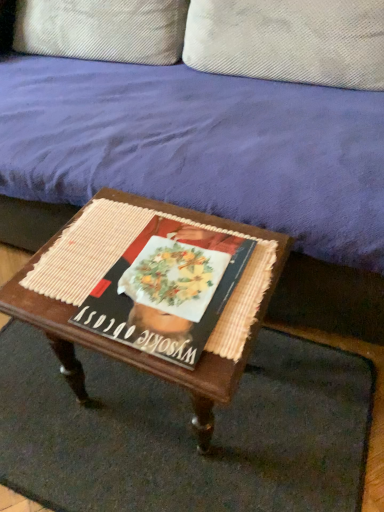
Measure the distance between velvet purple couch at upper center and camera.

The distance of velvet purple couch at upper center from camera is 83.79 centimeters.

Describe the element at coordinates (184, 433) in the screenshot. This screenshot has width=384, height=512. I see `woven mat at center` at that location.

Where is `woven mat at center`? Image resolution: width=384 pixels, height=512 pixels. woven mat at center is located at coordinates (184, 433).

I want to click on textured beige pillow at upper center, which appears as the first pillow when viewed from the left, so click(102, 29).

You are a GUI agent. You are given a task and a screenshot of the screen. Output one action in this format:
    pyautogui.click(x=<x>, y=<y>)
    Task: Click on the velvet purple couch at upper center
    The height and width of the screenshot is (512, 384).
    Given the screenshot: What is the action you would take?
    (201, 147)

Is velvet purple couch at upper center positioned before textured beige pillow at upper center, which appears as the first pillow when viewed from the left?

Yes, velvet purple couch at upper center is closer to the viewer.

I want to click on the 1st pillow directly above the velvet purple couch at upper center (from a real-world perspective), so click(102, 29).

Considering the points (49, 80) and (63, 31), which point is in front, point (49, 80) or point (63, 31)?

The point (49, 80) is in front.

Is velvet purple couch at upper center bigger than textured beige pillow at upper center, acting as the second pillow starting from the right?

Yes, velvet purple couch at upper center is bigger than textured beige pillow at upper center, acting as the second pillow starting from the right.

Which object is positioned more to the right, velvet purple couch at upper center or textured beige pillow at upper center, which ranks as the first pillow in right-to-left order?

textured beige pillow at upper center, which ranks as the first pillow in right-to-left order, is more to the right.

Is velvet purple couch at upper center facing towards textured beige pillow at upper center, the 2th pillow positioned from the left?

Yes.

Does point (182, 188) come closer to viewer compared to point (287, 26)?

Yes, it is.

Looking at this image, is textured beige pillow at upper center, acting as the second pillow starting from the right, facing away from velvet purple couch at upper center?

Yes.

Considering the positions of objects textured beige pillow at upper center, which appears as the first pillow when viewed from the left, and velvet purple couch at upper center in the image provided, who is behind, textured beige pillow at upper center, which appears as the first pillow when viewed from the left, or velvet purple couch at upper center?

textured beige pillow at upper center, which appears as the first pillow when viewed from the left, is further from the camera.

From a real-world perspective, is woven wood table at center on top of textured beige pillow at upper center, the 2th pillow positioned from the left?

No, from a real-world perspective, woven wood table at center is not above textured beige pillow at upper center, the 2th pillow positioned from the left.

Is woven wood table at center taller or shorter than textured beige pillow at upper center, the 2th pillow positioned from the left?

In the image, woven wood table at center appears to be taller than textured beige pillow at upper center, the 2th pillow positioned from the left.

Between woven wood table at center and textured beige pillow at upper center, which ranks as the first pillow in right-to-left order, which one is positioned behind?

textured beige pillow at upper center, which ranks as the first pillow in right-to-left order, is behind.

Find the location of a particular element. The height and width of the screenshot is (512, 384). pillow on the right of the woven wood table at center is located at coordinates (289, 40).

From the image's perspective, would you say woven wood table at center is shown under matte paper magazine at center?

Yes, from the image's perspective, woven wood table at center is below matte paper magazine at center.

From a real-world perspective, is woven wood table at center positioned under matte paper magazine at center based on gravity?

Yes, from a real-world perspective, woven wood table at center is beneath matte paper magazine at center.

Considering the relative sizes of woven wood table at center and matte paper magazine at center in the image provided, is woven wood table at center smaller than matte paper magazine at center?

Incorrect, woven wood table at center is not smaller in size than matte paper magazine at center.

Is woven wood table at center next to matte paper magazine at center?

Yes, woven wood table at center and matte paper magazine at center clearly make contact.

Can you confirm if woven wood table at center is positioned to the right of velvet purple couch at upper center?

Yes, woven wood table at center is to the right of velvet purple couch at upper center.

Locate an element on the screen. The height and width of the screenshot is (512, 384). table that appears below the velvet purple couch at upper center (from a real-world perspective) is located at coordinates (134, 349).

Does woven wood table at center have a smaller size compared to velvet purple couch at upper center?

Correct, woven wood table at center occupies less space than velvet purple couch at upper center.

Between point (18, 301) and point (94, 106), which one is positioned in front?

The point (18, 301) is closer.

Is the position of matte paper magazine at center less distant than that of textured beige pillow at upper center, which ranks as the first pillow in right-to-left order?

Yes, matte paper magazine at center is closer to the camera.

Does matte paper magazine at center appear on the left side of textured beige pillow at upper center, the 2th pillow positioned from the left?

Yes, matte paper magazine at center is to the left of textured beige pillow at upper center, the 2th pillow positioned from the left.

Locate an element on the screen. pillow on the right of the matte paper magazine at center is located at coordinates (289, 40).

Find the location of `pillow on the left of velvet purple couch at upper center`. pillow on the left of velvet purple couch at upper center is located at coordinates (102, 29).

Locate an element on the screen. pillow on the right of velvet purple couch at upper center is located at coordinates (289, 40).

Based on their spatial positions, is woven mat at center or woven wood table at center closer to matte paper magazine at center?

woven wood table at center lies closer to matte paper magazine at center than the other object.

Looking at the image, which one is located further to woven mat at center, velvet purple couch at upper center or textured beige pillow at upper center, acting as the second pillow starting from the right?

Among the two, textured beige pillow at upper center, acting as the second pillow starting from the right, is located further to woven mat at center.

Looking at the image, which one is located closer to textured beige pillow at upper center, which appears as the first pillow when viewed from the left, woven mat at center or matte paper magazine at center?

Among the two, matte paper magazine at center is located nearer to textured beige pillow at upper center, which appears as the first pillow when viewed from the left.

Based on their spatial positions, is textured beige pillow at upper center, acting as the second pillow starting from the right, or woven wood table at center closer to woven mat at center?

woven wood table at center is closer to woven mat at center.

Which object lies nearer to the anchor point textured beige pillow at upper center, which appears as the first pillow when viewed from the left, textured beige pillow at upper center, the 2th pillow positioned from the left, or velvet purple couch at upper center?

textured beige pillow at upper center, the 2th pillow positioned from the left.

Looking at the image, which one is located closer to woven wood table at center, matte paper magazine at center or woven mat at center?

matte paper magazine at center.

Estimate the real-world distances between objects in this image. Which object is further from woven wood table at center, velvet purple couch at upper center or textured beige pillow at upper center, the 2th pillow positioned from the left?

Among the two, textured beige pillow at upper center, the 2th pillow positioned from the left, is located further to woven wood table at center.

Which object lies nearer to the anchor point matte paper magazine at center, woven mat at center or textured beige pillow at upper center, acting as the second pillow starting from the right?

The object closer to matte paper magazine at center is woven mat at center.

At what (x,y) coordinates should I click in order to perform the action: click on magazine between velvet purple couch at upper center and woven wood table at center vertically. Please return your answer as a coordinate pair (x, y). This screenshot has width=384, height=512. Looking at the image, I should click on (163, 292).

Locate an element on the screen. Image resolution: width=384 pixels, height=512 pixels. studio couch that lies between textured beige pillow at upper center, acting as the second pillow starting from the right, and matte paper magazine at center from top to bottom is located at coordinates pos(201,147).

Identify the location of table between textured beige pillow at upper center, the 2th pillow positioned from the left, and woven mat at center, in the vertical direction. (134, 349).

Identify the location of magazine between velvet purple couch at upper center and woven mat at center vertically. The width and height of the screenshot is (384, 512). (163, 292).